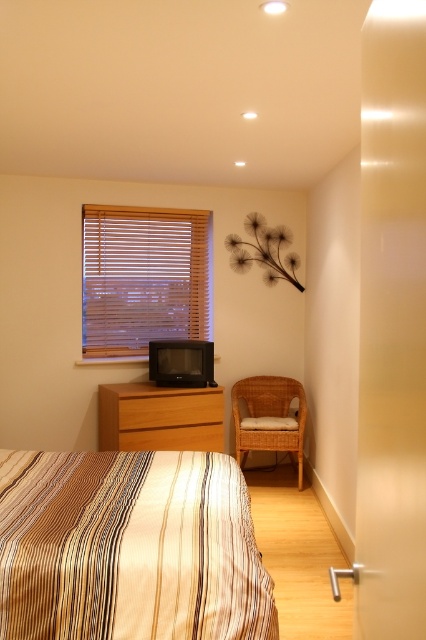
In the scene shown: You are standing in the bedroom and want to determine which of the two points, point 1 at coordinates point (x=104, y=412) or point 2 at coordinates point (x=252, y=385), is closer to you. Based on the scene description, which point is nearer?

Point 1 at coordinates point (x=104, y=412) is closer to the viewer than point 2 at coordinates point (x=252, y=385).

You are standing next to a camera in the bedroom and want to place it on the striped fabric bed at lower left. Can you reach the bed from your current position without moving your feet?

The striped fabric bed at lower left and camera are 6.39 feet apart from each other, so you cannot reach the bed from your current position without moving your feet since the distance is too far.